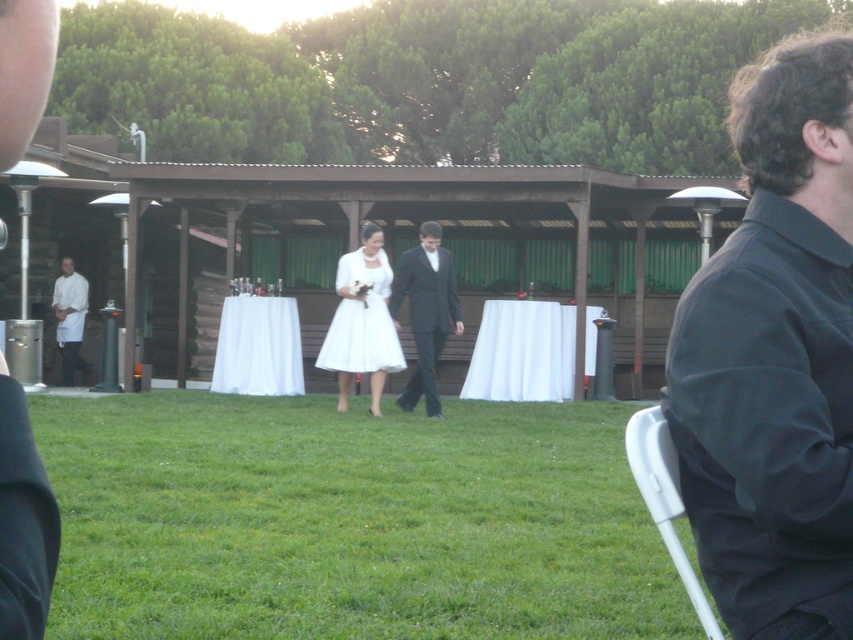
Which of these two, white fabric tablecloth at center or white linen chef at left, stands shorter?

With less height is white fabric tablecloth at center.

Does white fabric tablecloth at center appear under white linen chef at left?

Incorrect, white fabric tablecloth at center is not positioned below white linen chef at left.

Between point (20, 426) and point (78, 336), which one is positioned in front?

Positioned in front is point (20, 426).

The width and height of the screenshot is (853, 640). I want to click on white fabric tablecloth at center, so click(x=22, y=522).

Between point (228, 410) and point (329, 330), which one is positioned in front?

Point (228, 410) is in front.

This screenshot has width=853, height=640. I want to click on green grass at center, so click(x=349, y=520).

What do you see at coordinates (775, 356) in the screenshot? I see `dark gray fabric shirt at right` at bounding box center [775, 356].

Is dark gray fabric shirt at right taller than black satin suit at center?

In fact, dark gray fabric shirt at right may be shorter than black satin suit at center.

Image resolution: width=853 pixels, height=640 pixels. Identify the location of dark gray fabric shirt at right. (775, 356).